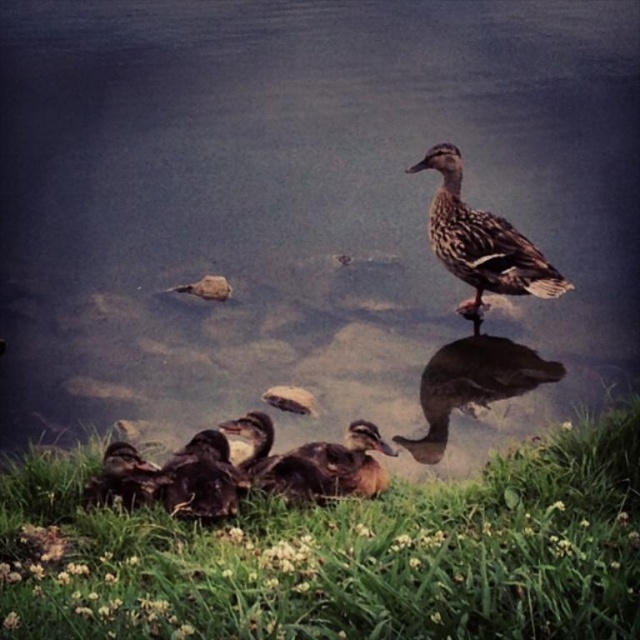
You are a wildlife photographer trying to capture a close shot of the brown speckled duck at upper right and the brown feathered duck at center. Given that your camera lens can only focus on objects wider than 10 cm, can you determine which duck you can focus on?

The brown speckled duck at upper right is less than 10 cm wide, while the brown feathered duck at center is wider than 10 cm. Therefore, you can focus on the brown feathered duck at center with your camera lens.